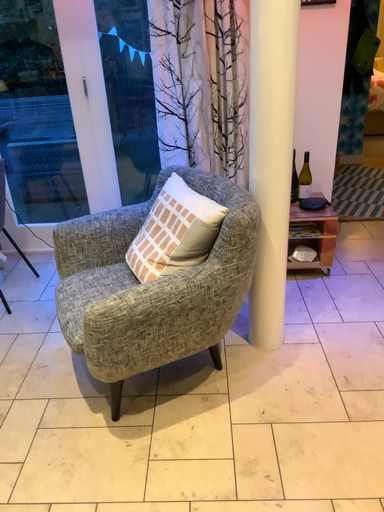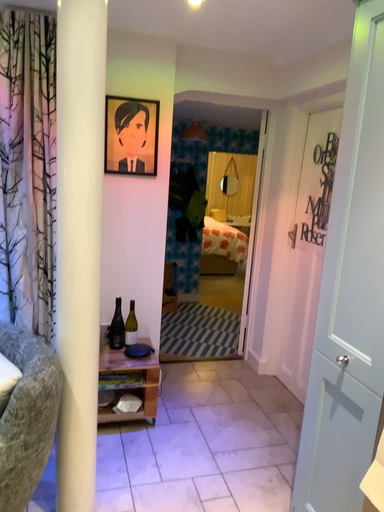
Question: Which way did the camera rotate in the video?

Choices:
 (A) rotated right
 (B) rotated left

Answer: (A)